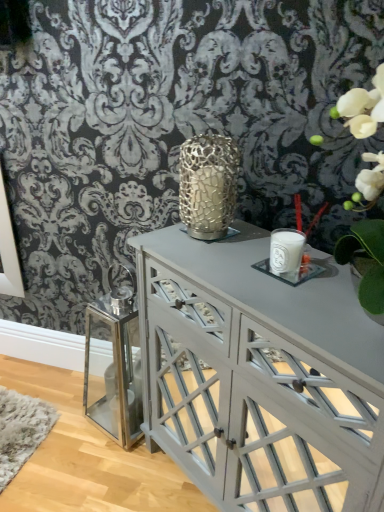
You are a GUI agent. You are given a task and a screenshot of the screen. Output one action in this format:
    pyautogui.click(x=<x>, y=<y>)
    Task: Click on the vacant position to the left of white glass candle at center, the second candle holder positioned from the left
    The width and height of the screenshot is (384, 512).
    Given the screenshot: What is the action you would take?
    pyautogui.click(x=224, y=268)